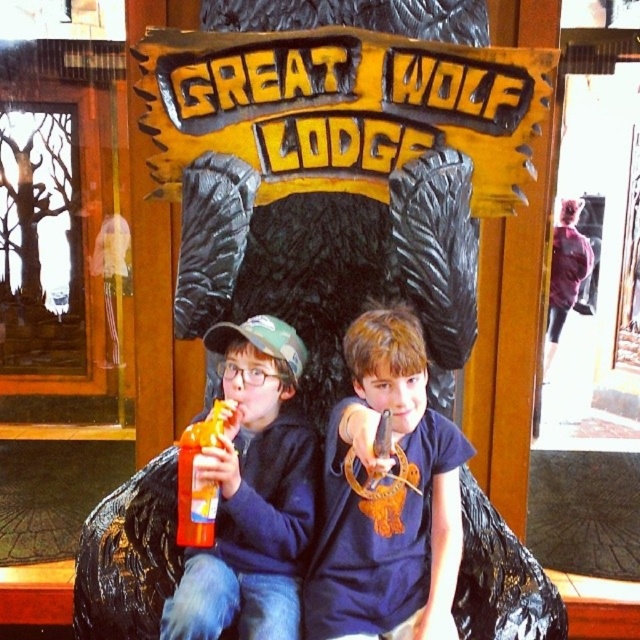
Which is in front, point (307, 570) or point (196, 480)?

Point (196, 480) is more forward.

Based on the photo, is blue matte shirt at center shorter than orange plastic bottle at center?

No, blue matte shirt at center is not shorter than orange plastic bottle at center.

Is point (433, 570) positioned after point (236, 420)?

Yes, point (433, 570) is behind point (236, 420).

You are a GUI agent. You are given a task and a screenshot of the screen. Output one action in this format:
    pyautogui.click(x=<x>, y=<y>)
    Task: Click on the blue matte shirt at center
    Image resolution: width=640 pixels, height=640 pixels.
    Given the screenshot: What is the action you would take?
    pyautogui.click(x=387, y=500)

Find the location of a particular element. Image resolution: width=640 pixels, height=640 pixels. blue matte shirt at center is located at coordinates (387, 500).

Does blue matte shirt at center have a greater width compared to matte plastic soda at left?

Yes, blue matte shirt at center is wider than matte plastic soda at left.

What do you see at coordinates (387, 500) in the screenshot? I see `blue matte shirt at center` at bounding box center [387, 500].

Identify the location of blue matte shirt at center. (387, 500).

Does matte plastic soda at left have a lesser width compared to orange plastic bottle at center?

No, matte plastic soda at left is not thinner than orange plastic bottle at center.

Between point (298, 502) and point (202, 513), which one is positioned behind?

The point (298, 502) is more distant.

What are the coordinates of `matte plastic soda at left` in the screenshot? It's located at (252, 492).